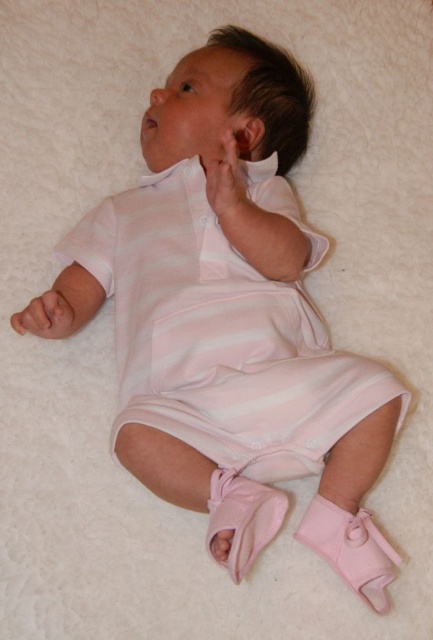
You are a photographer standing at a certain distance from the baby. You want to take a closeup shot of the pink fabric hand at upper center without moving the camera. Is the current distance sufficient for capturing the hand in focus?

The distance between the pink fabric hand at upper center and the viewer is 3.93 feet. Since the photographer is already at this distance, they can capture the hand in focus without needing to move closer.